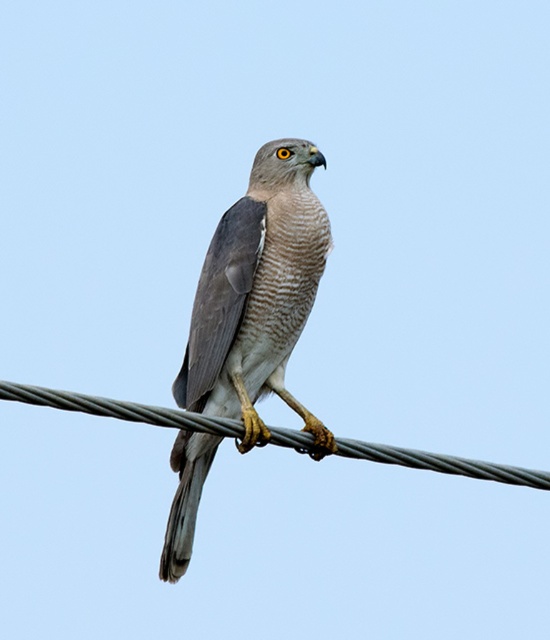
Between gray feathered falcon at center and black wire at center, which one is positioned higher?

gray feathered falcon at center is higher up.

Is gray feathered falcon at center to the right of black wire at center from the viewer's perspective?

No, gray feathered falcon at center is not to the right of black wire at center.

From the picture: Who is more distant from viewer, (295, 326) or (377, 444)?

Positioned behind is point (377, 444).

Locate an element on the screen. The image size is (550, 640). gray feathered falcon at center is located at coordinates (257, 294).